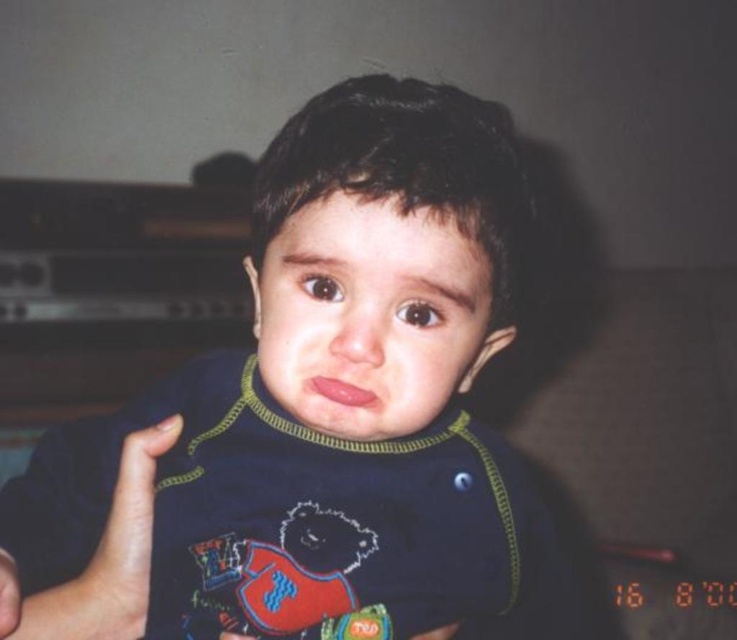
You are a photographer trying to capture the child in the image. You notice a dark blue fabric at center located at point (326,419). Can you confirm if this fabric is positioned exactly at the center of the image?

The dark blue fabric at center is located at point (326,419), which is the exact center of the image.

You are a photographer adjusting your camera settings. You notice two points in the image labeled as point (391, 365) and point (150, 464). Which point is nearer to your camera lens?

Point (391, 365) is closer to the camera than point (150, 464), so the first point is nearer to the camera lens.

You are a photographer trying to focus on the dark blue fabric at center in the image. What are the exact coordinates where you should adjust your camera to capture it precisely?

The dark blue fabric at center is located at coordinates point (326, 419), so you should adjust your camera to that exact point to capture it precisely.